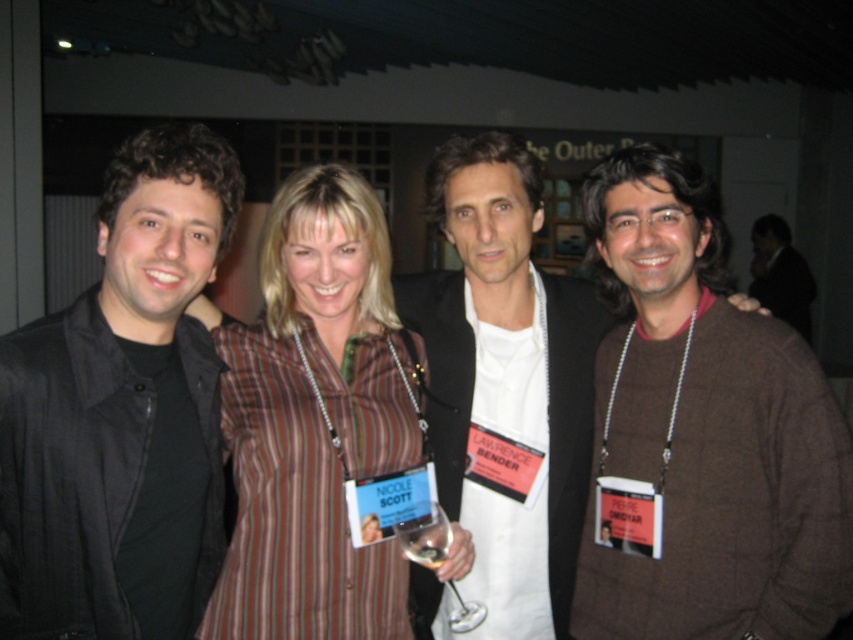
Between striped fabric shirt at center and brown wool sweater at right, which one is positioned lower?

Positioned lower is striped fabric shirt at center.

Is striped fabric shirt at center wider than brown wool sweater at right?

Yes, striped fabric shirt at center is wider than brown wool sweater at right.

Find the location of a particular element. This screenshot has width=853, height=640. striped fabric shirt at center is located at coordinates coord(315,420).

Find the location of a particular element. striped fabric shirt at center is located at coordinates point(315,420).

Which is behind, point (492, 209) or point (430, 504)?

The point (492, 209) is behind.

You are a GUI agent. You are given a task and a screenshot of the screen. Output one action in this format:
    pyautogui.click(x=<x>, y=<y>)
    Task: Click on the white matte shirt at center
    
    Given the screenshot: What is the action you would take?
    pyautogui.click(x=505, y=378)

Can you confirm if striped fabric shirt at center is shorter than clear glass wine glass at center?

No.

Can you confirm if striped fabric shirt at center is smaller than clear glass wine glass at center?

Actually, striped fabric shirt at center might be larger than clear glass wine glass at center.

Where is `striped fabric shirt at center`? This screenshot has height=640, width=853. striped fabric shirt at center is located at coordinates (315, 420).

The width and height of the screenshot is (853, 640). I want to click on striped fabric shirt at center, so click(315, 420).